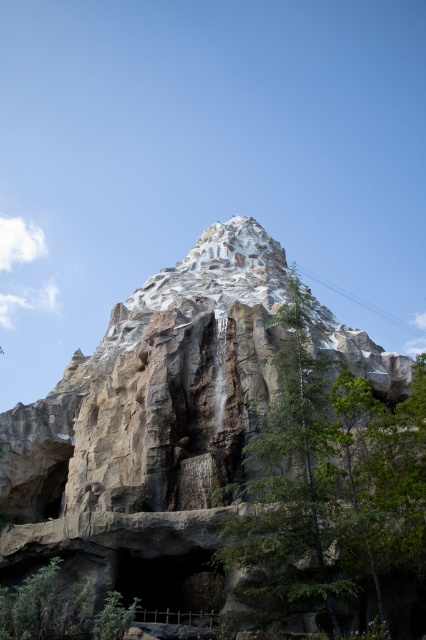
Question: Is rocky cliff at center to the right of green leafy tree at center from the viewer's perspective?

Choices:
 (A) no
 (B) yes

Answer: (A)

Question: Which object is closer to the camera taking this photo?

Choices:
 (A) green leafy tree at lower left
 (B) green leafy tree at center
 (C) rocky cliff at center

Answer: (A)

Question: Which object appears farthest from the camera in this image?

Choices:
 (A) green leafy tree at lower left
 (B) rocky cliff at center
 (C) green leafy tree at center

Answer: (B)

Question: Considering the real-world distances, which object is closest to the green leafy tree at lower left?

Choices:
 (A) rocky cliff at center
 (B) green leafy tree at center

Answer: (B)

Question: Can you confirm if rocky cliff at center is smaller than green leafy tree at center?

Choices:
 (A) yes
 (B) no

Answer: (B)

Question: From the image, what is the correct spatial relationship of rocky cliff at center in relation to green leafy tree at lower left?

Choices:
 (A) above
 (B) below

Answer: (A)